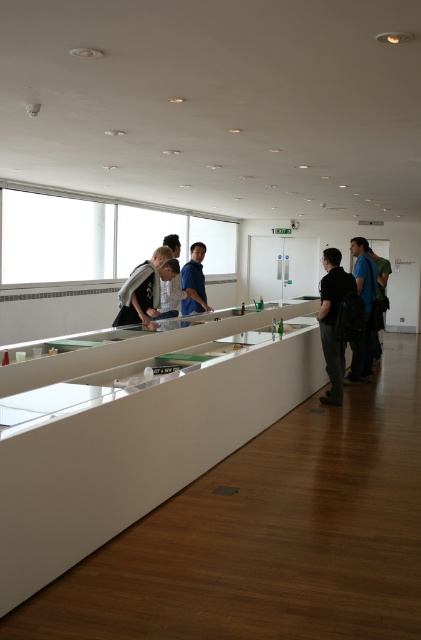
Question: Can you confirm if black matte jacket at center is positioned above blue fabric backpack at center?

Choices:
 (A) no
 (B) yes

Answer: (A)

Question: Can you confirm if matte gray shirt at center is positioned below blue fabric shirt at right?

Choices:
 (A) yes
 (B) no

Answer: (B)

Question: Which point is closer to the camera taking this photo?

Choices:
 (A) (343, 355)
 (B) (31, 566)

Answer: (B)

Question: Which object appears farthest from the camera in this image?

Choices:
 (A) blue fabric shirt at right
 (B) matte gray shirt at center
 (C) blue fabric backpack at center
 (D) white glossy counter at center

Answer: (C)

Question: Is white glossy counter at center wider than blue fabric shirt at right?

Choices:
 (A) yes
 (B) no

Answer: (A)

Question: Among these objects, which one is farthest from the camera?

Choices:
 (A) blue fabric shirt at right
 (B) black matte jacket at center

Answer: (A)